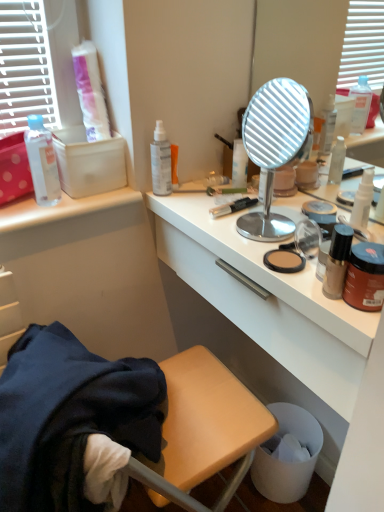
Image resolution: width=384 pixels, height=512 pixels. What are the coordinates of `free space to the back side of metallic round mirror at center` in the screenshot? It's located at (235, 196).